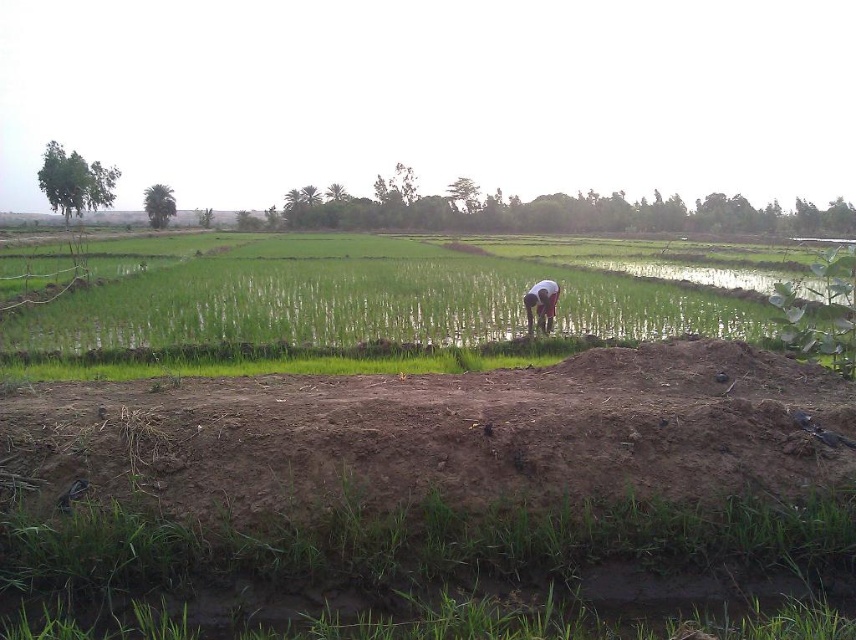
Who is more forward, (722, 291) or (550, 296)?

Point (550, 296)

Consider the image. Can you confirm if green grass at center is positioned to the left of dark brown skin at center?

Indeed, green grass at center is positioned on the left side of dark brown skin at center.

Between point (12, 353) and point (548, 305), which one is positioned behind?

Point (548, 305)

You are a GUI agent. You are given a task and a screenshot of the screen. Output one action in this format:
    pyautogui.click(x=<x>, y=<y>)
    Task: Click on the green grass at center
    
    Given the screenshot: What is the action you would take?
    pyautogui.click(x=415, y=301)